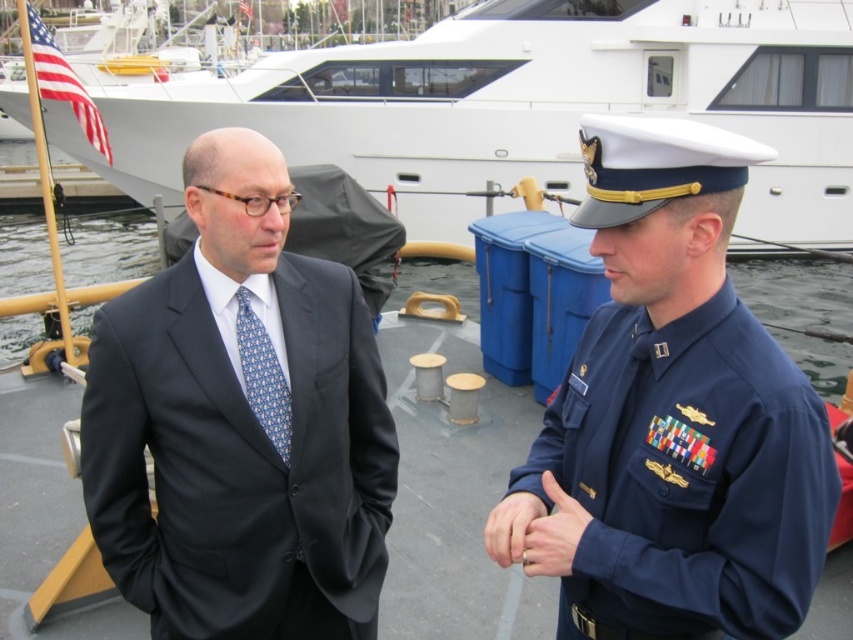
Question: Which of the following is the farthest from the observer?

Choices:
 (A) navy blue uniform at center
 (B) smooth skin hand at center

Answer: (B)

Question: Can you confirm if navy blue uniform at center is bigger than blue printed silk tie at center?

Choices:
 (A) yes
 (B) no

Answer: (A)

Question: Which object is positioned closest to the smooth skin hand at center?

Choices:
 (A) matte black suit at center
 (B) white glossy yacht at upper center
 (C) blue printed silk tie at center
 (D) navy blue uniform at center

Answer: (D)

Question: Which is farther from the navy blue uniform at center?

Choices:
 (A) white glossy yacht at upper center
 (B) matte black suit at center

Answer: (A)

Question: Is matte black suit at center bigger than smooth skin hand at center?

Choices:
 (A) yes
 (B) no

Answer: (A)

Question: Does navy blue uniform at center have a lesser width compared to smooth skin hand at center?

Choices:
 (A) no
 (B) yes

Answer: (A)